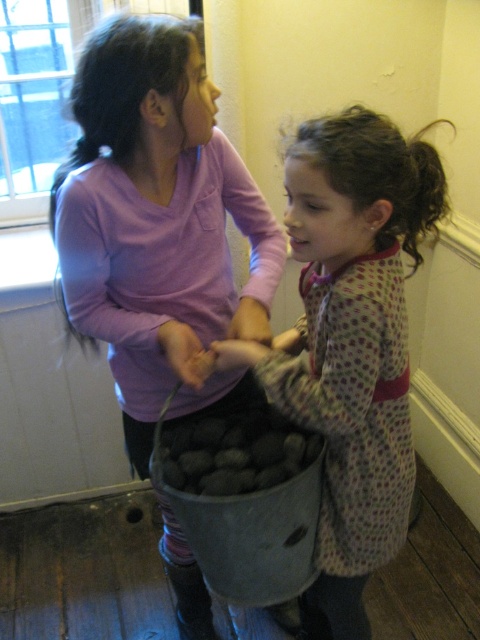
Question: Which object is positioned farthest from the metallic bucket of rocks at center?

Choices:
 (A) metallic gray bucket at center
 (B) dark gray stone at center

Answer: (B)

Question: Which point is farther from the camera taking this photo?

Choices:
 (A) (189, 360)
 (B) (260, 380)
 (C) (248, 563)

Answer: (A)

Question: Can you confirm if metallic gray bucket at center is positioned below dark gray stone at center?

Choices:
 (A) yes
 (B) no

Answer: (A)

Question: Is matte pink shirt at center above dark gray stone at center?

Choices:
 (A) yes
 (B) no

Answer: (A)

Question: Among these points, which one is farthest from the camera?

Choices:
 (A) (252, 486)
 (B) (282, 548)
 (C) (324, 388)

Answer: (B)

Question: Can you confirm if metallic bucket of rocks at center is bigger than metallic gray bucket at center?

Choices:
 (A) yes
 (B) no

Answer: (A)